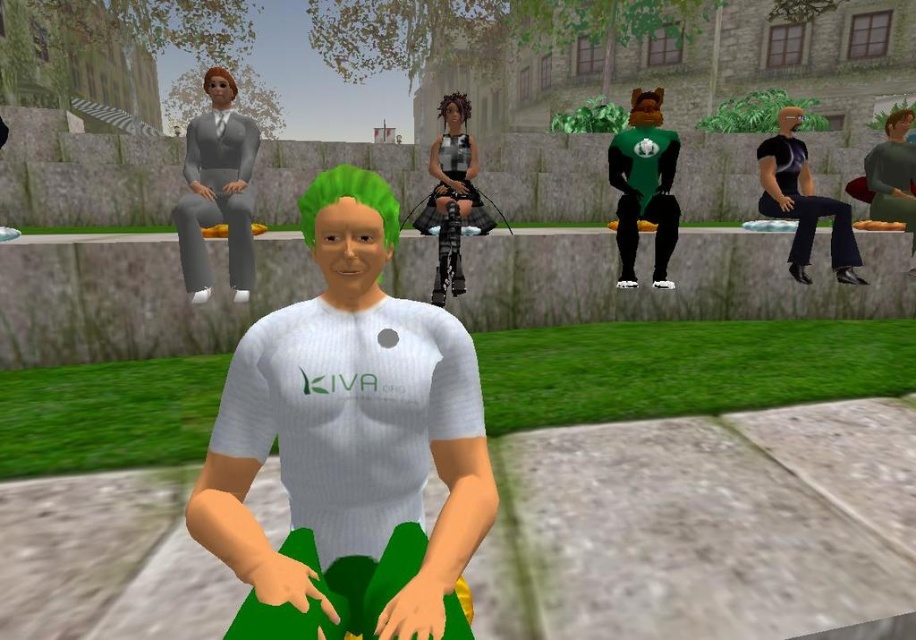
Based on the photo, you are a character in the game holding a small item that is 12 inches long. You want to place it between the brown leather bag at right and the brown fuzzy hair at upper right. Is there enough space to fit it there?

The brown leather bag at right and brown fuzzy hair at upper right are 18.95 inches apart. Since the item is 12 inches long, there is enough space to fit it between them.